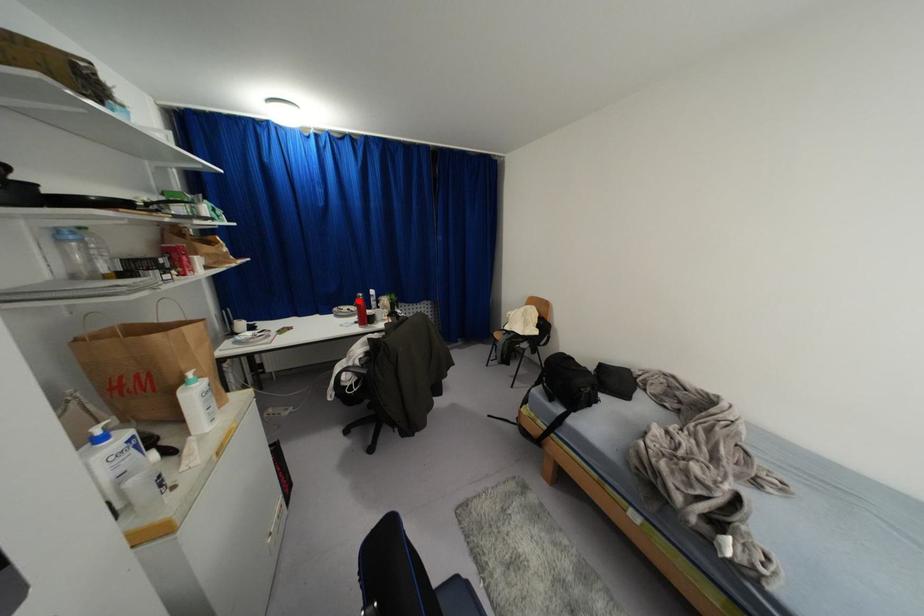
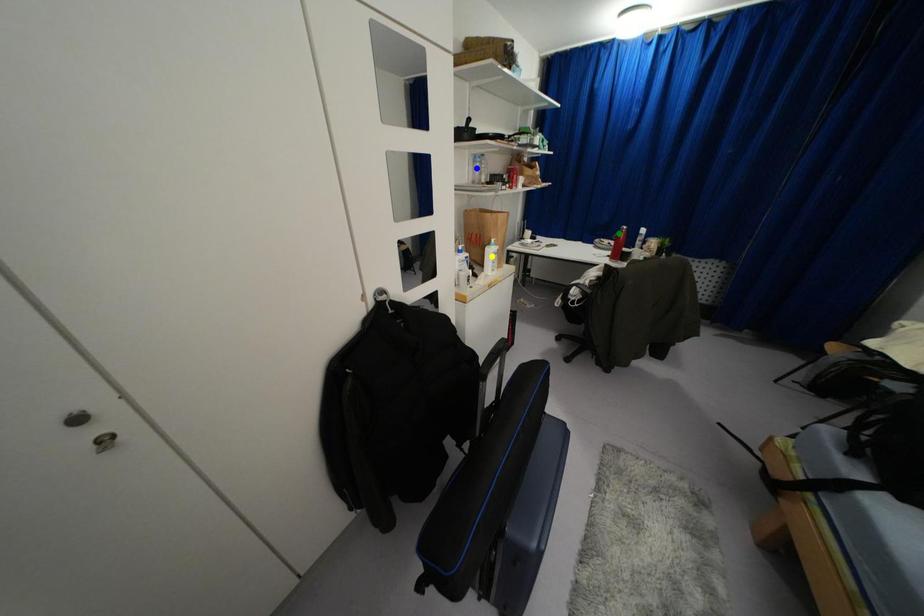
Question: I am providing you with two images of the same scene from different viewpoints. A red point is marked on the first image. You are given multiple points on the second image. Which spot in image 2 lines up with the point in image 1?

Choices:
 (A) blue point
 (B) yellow point
 (C) green point

Answer: (C)